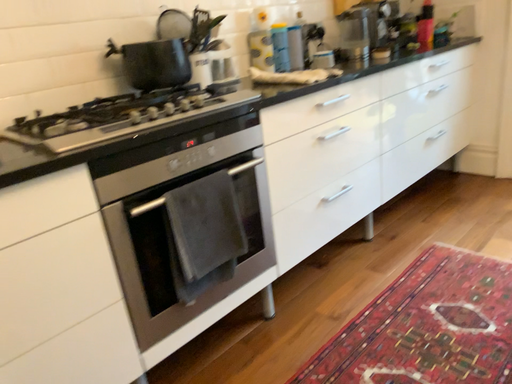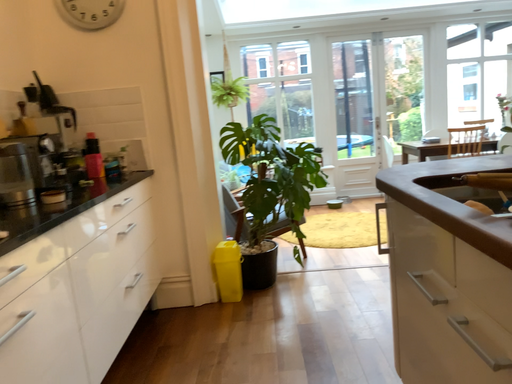
Question: How did the camera likely rotate when shooting the video?

Choices:
 (A) rotated right
 (B) rotated left

Answer: (A)